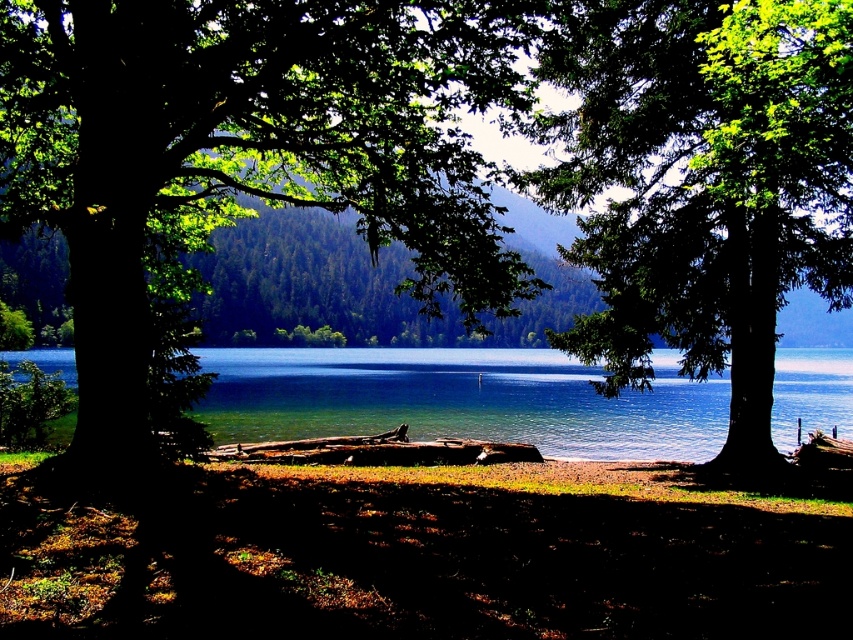
You are planning to set up a picnic area between the green leafy tree at left and the green leafy tree at center. Considering their sizes, which tree would provide more shade for your picnic spot?

The green leafy tree at left is bigger than the green leafy tree at center, so it would provide more shade for the picnic spot.

You are a bird looking for a nesting spot. You see the green leafy tree at left and the green leafy tree at center. Which tree is taller and better for nesting?

The green leafy tree at center is taller than the green leafy tree at left, so it would be better for nesting.

You are standing at the edge of the lake and notice the brown dirt at lower center and the clear blue water at center. Which surface is lower in height?

The brown dirt at lower center is shorter than the clear blue water at center, so the brown dirt at lower center is lower in height.